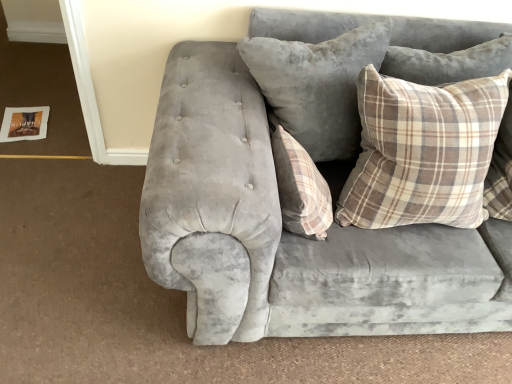
Locate an element on the screen. velvet gray couch at center is located at coordinates (289, 233).

Describe the element at coordinates (317, 85) in the screenshot. I see `velvet gray pillow at center, which appears as the 2th pillow when viewed from the left` at that location.

What are the coordinates of `velvet gray pillow at center, positioned as the second pillow in right-to-left order` in the screenshot? It's located at (317, 85).

Image resolution: width=512 pixels, height=384 pixels. What do you see at coordinates (300, 188) in the screenshot?
I see `plaid fabric pillow at center, marked as the 3th pillow in a right-to-left arrangement` at bounding box center [300, 188].

This screenshot has height=384, width=512. In order to click on velvet gray couch at center in this screenshot , I will do `click(289, 233)`.

From a real-world perspective, which object stands above the other?

velvet gray pillow at center, which appears as the 2th pillow when viewed from the left, is physically above.

Choose the correct answer: Is plaid fabric pillow at upper right, which is the third pillow in left-to-right order, inside velvet gray pillow at center, which appears as the 2th pillow when viewed from the left, or outside it?

plaid fabric pillow at upper right, which is the third pillow in left-to-right order, exists outside the volume of velvet gray pillow at center, which appears as the 2th pillow when viewed from the left.

Can you confirm if plaid fabric pillow at upper right, which is the third pillow in left-to-right order, is positioned to the right of velvet gray pillow at center, which appears as the 2th pillow when viewed from the left?

Yes, plaid fabric pillow at upper right, which is the third pillow in left-to-right order, is to the right of velvet gray pillow at center, which appears as the 2th pillow when viewed from the left.

From a real-world perspective, who is located higher, velvet gray pillow at center, positioned as the second pillow in right-to-left order, or velvet gray couch at center?

From a 3D spatial view, velvet gray pillow at center, positioned as the second pillow in right-to-left order, is above.

Which is less distant, (276, 54) or (244, 137)?

Point (276, 54) appears to be farther away from the viewer than point (244, 137).

Considering the relative sizes of velvet gray pillow at center, which appears as the 2th pillow when viewed from the left, and velvet gray couch at center in the image provided, is velvet gray pillow at center, which appears as the 2th pillow when viewed from the left, smaller than velvet gray couch at center?

Yes.

Is velvet gray pillow at center, which appears as the 2th pillow when viewed from the left, positioned far away from velvet gray couch at center?

No, velvet gray pillow at center, which appears as the 2th pillow when viewed from the left, is in close proximity to velvet gray couch at center.

Between velvet gray couch at center and plaid fabric pillow at upper right, which is the third pillow in left-to-right order, which one is positioned in front?

velvet gray couch at center.

Between velvet gray couch at center and plaid fabric pillow at upper right, which is the third pillow in left-to-right order, which one appears on the right side from the viewer's perspective?

From the viewer's perspective, velvet gray couch at center appears more on the right side.

Is velvet gray couch at center spatially inside plaid fabric pillow at upper right, which is the third pillow in left-to-right order, or outside of it?

velvet gray couch at center exists outside the volume of plaid fabric pillow at upper right, which is the third pillow in left-to-right order.

Can you see velvet gray couch at center touching plaid fabric pillow at upper right, which is the third pillow in left-to-right order?

No, velvet gray couch at center is not touching plaid fabric pillow at upper right, which is the third pillow in left-to-right order.

From a real-world perspective, is plaid fabric pillow at upper right, positioned as the first pillow in right-to-left order, under velvet gray couch at center?

Actually, plaid fabric pillow at upper right, positioned as the first pillow in right-to-left order, is physically above velvet gray couch at center in the real world.

Is point (419, 143) closer to viewer compared to point (223, 207)?

No.

Considering the sizes of objects plaid fabric pillow at upper right, positioned as the first pillow in right-to-left order, and velvet gray couch at center in the image provided, who is bigger, plaid fabric pillow at upper right, positioned as the first pillow in right-to-left order, or velvet gray couch at center?

Bigger between the two is velvet gray couch at center.

Is plaid fabric pillow at upper right, which is the third pillow in left-to-right order, inside or outside of velvet gray couch at center?

The correct answer is: inside.

Who is taller, velvet gray pillow at center, positioned as the second pillow in right-to-left order, or plaid fabric pillow at center, marked as the 3th pillow in a right-to-left arrangement?

velvet gray pillow at center, positioned as the second pillow in right-to-left order, is taller.

Between velvet gray pillow at center, which appears as the 2th pillow when viewed from the left, and plaid fabric pillow at center, acting as the 1th pillow starting from the left, which one is positioned in front?

plaid fabric pillow at center, acting as the 1th pillow starting from the left.

Is velvet gray pillow at center, which appears as the 2th pillow when viewed from the left, looking in the opposite direction of plaid fabric pillow at center, marked as the 3th pillow in a right-to-left arrangement?

No, velvet gray pillow at center, which appears as the 2th pillow when viewed from the left,'s orientation is not away from plaid fabric pillow at center, marked as the 3th pillow in a right-to-left arrangement.

Considering the positions of points (312, 108) and (287, 182), is point (312, 108) farther from camera compared to point (287, 182)?

Yes, it is.

How different are the orientations of plaid fabric pillow at center, acting as the 1th pillow starting from the left, and plaid fabric pillow at upper right, which is the third pillow in left-to-right order, in degrees?

The facing directions of plaid fabric pillow at center, acting as the 1th pillow starting from the left, and plaid fabric pillow at upper right, which is the third pillow in left-to-right order, are 90 degrees apart.

Can you confirm if plaid fabric pillow at center, acting as the 1th pillow starting from the left, is wider than plaid fabric pillow at upper right, which is the third pillow in left-to-right order?

No, plaid fabric pillow at center, acting as the 1th pillow starting from the left, is not wider than plaid fabric pillow at upper right, which is the third pillow in left-to-right order.

Which is behind, point (280, 183) or point (487, 132)?

The point (487, 132) is behind.

Is plaid fabric pillow at center, acting as the 1th pillow starting from the left, closer to the viewer compared to plaid fabric pillow at upper right, which is the third pillow in left-to-right order?

That is False.

Which is more to the right, plaid fabric pillow at center, acting as the 1th pillow starting from the left, or velvet gray couch at center?

From the viewer's perspective, velvet gray couch at center appears more on the right side.

Does plaid fabric pillow at center, marked as the 3th pillow in a right-to-left arrangement, touch velvet gray couch at center?

There is a gap between plaid fabric pillow at center, marked as the 3th pillow in a right-to-left arrangement, and velvet gray couch at center.

From a real-world perspective, which object stands above the other?

In real-world perspective, plaid fabric pillow at center, acting as the 1th pillow starting from the left, is above.

Locate an element on the screen. The height and width of the screenshot is (384, 512). studio couch that is on the right side of plaid fabric pillow at center, marked as the 3th pillow in a right-to-left arrangement is located at coordinates (289, 233).

You are a GUI agent. You are given a task and a screenshot of the screen. Output one action in this format:
    pyautogui.click(x=<x>, y=<y>)
    Task: Click on the pillow that is the 2nd object located in front of the velvet gray pillow at center, which appears as the 2th pillow when viewed from the left
    
    Given the screenshot: What is the action you would take?
    pyautogui.click(x=422, y=151)

The width and height of the screenshot is (512, 384). What are the coordinates of `pillow that is the 2nd object located above the velvet gray couch at center (from the image's perspective)` in the screenshot? It's located at (317, 85).

When comparing their distances from plaid fabric pillow at upper right, positioned as the first pillow in right-to-left order, does plaid fabric pillow at center, marked as the 3th pillow in a right-to-left arrangement, or velvet gray couch at center seem closer?

velvet gray couch at center is closer to plaid fabric pillow at upper right, positioned as the first pillow in right-to-left order.

Which object lies further to the anchor point velvet gray couch at center, plaid fabric pillow at upper right, which is the third pillow in left-to-right order, or plaid fabric pillow at center, acting as the 1th pillow starting from the left?

The object further to velvet gray couch at center is plaid fabric pillow at upper right, which is the third pillow in left-to-right order.

When comparing their distances from plaid fabric pillow at upper right, positioned as the first pillow in right-to-left order, does velvet gray pillow at center, positioned as the second pillow in right-to-left order, or plaid fabric pillow at center, acting as the 1th pillow starting from the left, seem further?

plaid fabric pillow at center, acting as the 1th pillow starting from the left.

From the picture: Which object lies further to the anchor point velvet gray couch at center, plaid fabric pillow at upper right, which is the third pillow in left-to-right order, or velvet gray pillow at center, positioned as the second pillow in right-to-left order?

The object further to velvet gray couch at center is plaid fabric pillow at upper right, which is the third pillow in left-to-right order.

From the image, which object appears to be farther from velvet gray pillow at center, positioned as the second pillow in right-to-left order, velvet gray couch at center or plaid fabric pillow at upper right, which is the third pillow in left-to-right order?

The object further to velvet gray pillow at center, positioned as the second pillow in right-to-left order, is velvet gray couch at center.

Considering their positions, is plaid fabric pillow at upper right, positioned as the first pillow in right-to-left order, positioned closer to velvet gray pillow at center, positioned as the second pillow in right-to-left order, than plaid fabric pillow at center, marked as the 3th pillow in a right-to-left arrangement?

The object closer to velvet gray pillow at center, positioned as the second pillow in right-to-left order, is plaid fabric pillow at center, marked as the 3th pillow in a right-to-left arrangement.

Looking at the image, which one is located closer to plaid fabric pillow at center, marked as the 3th pillow in a right-to-left arrangement, plaid fabric pillow at upper right, positioned as the first pillow in right-to-left order, or velvet gray pillow at center, which appears as the 2th pillow when viewed from the left?

velvet gray pillow at center, which appears as the 2th pillow when viewed from the left, is positioned closer to the anchor plaid fabric pillow at center, marked as the 3th pillow in a right-to-left arrangement.

Looking at the image, which one is located further to plaid fabric pillow at upper right, positioned as the first pillow in right-to-left order, velvet gray pillow at center, positioned as the second pillow in right-to-left order, or velvet gray couch at center?

Based on the image, velvet gray couch at center appears to be further to plaid fabric pillow at upper right, positioned as the first pillow in right-to-left order.

The image size is (512, 384). In order to click on pillow situated between velvet gray pillow at center, which appears as the 2th pillow when viewed from the left, and velvet gray couch at center from left to right in this screenshot , I will do `click(422, 151)`.

Find the location of a particular element. pillow between plaid fabric pillow at center, marked as the 3th pillow in a right-to-left arrangement, and plaid fabric pillow at upper right, positioned as the first pillow in right-to-left order is located at coordinates (317, 85).